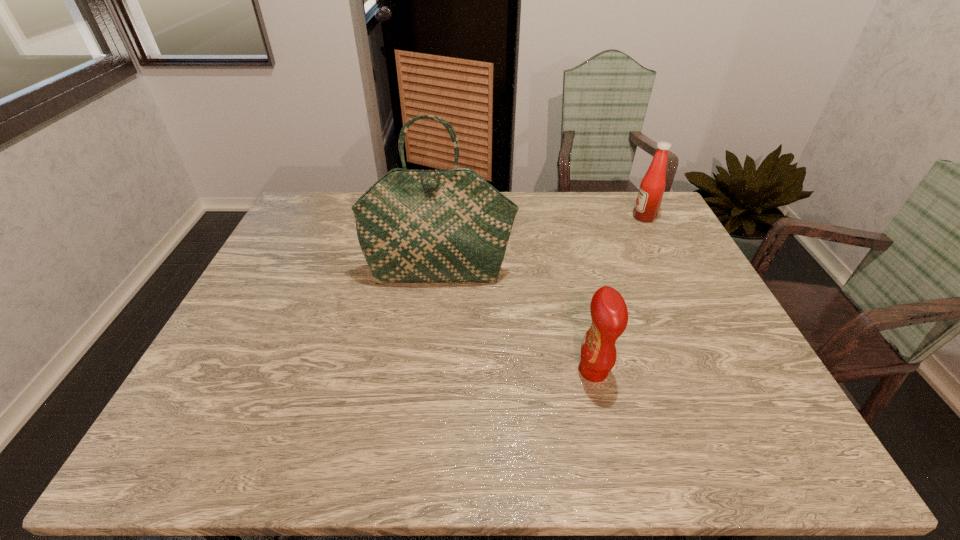
Identify which object is the second closest to the leftmost object. Please provide its 2D coordinates. Your answer should be formatted as a tuple, i.e. [(x, y)], where the tuple contains the x and y coordinates of a point satisfying the conditions above.

[(648, 201)]